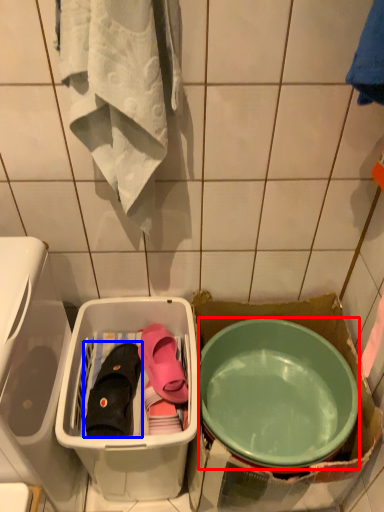
Question: Which object appears closest to the camera in this image, mixing bowl (highlighted by a red box) or footwear (highlighted by a blue box)?

Choices:
 (A) mixing bowl
 (B) footwear

Answer: (A)